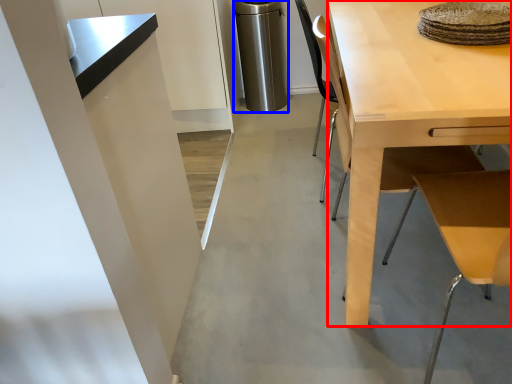
Question: Which object appears closest to the camera in this image, desk (highlighted by a red box) or appliance (highlighted by a blue box)?

Choices:
 (A) desk
 (B) appliance

Answer: (A)